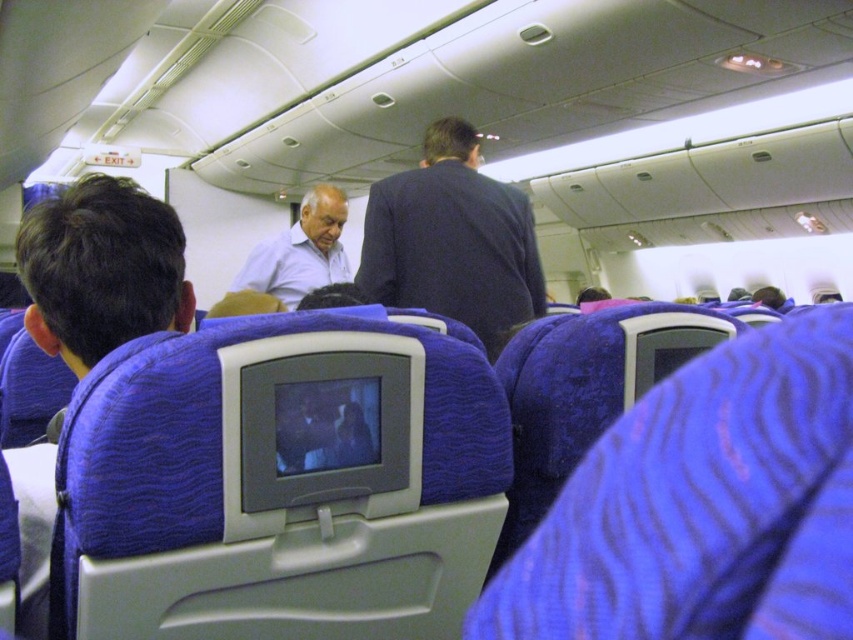
You are seated in an airplane cabin and notice two passengers ahead of you. One is wearing a dark blue suit at center, and the other has a blue fabric shirt at left. Which passenger is standing closer to the ceiling?

The dark blue suit at center is taller than the blue fabric shirt at left, so the passenger in the dark blue suit at center is closer to the ceiling.

You are seated in the airplane cabin and notice two passengers ahead. Which one is positioned more to the left side between the blue fabric shirt at left and the light blue shirt at center?

The blue fabric shirt at left is positioned more to the left side than the light blue shirt at center.